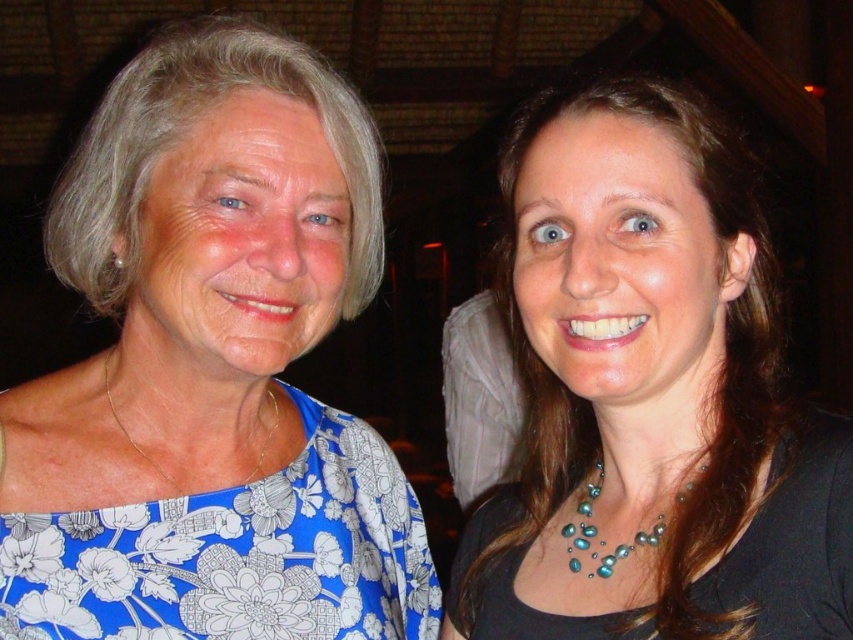
You are a photographer adjusting the lighting in this scene. You need to ensure both necklaces are equally illuminated. Which necklace should you adjust the light towards, the black matte necklace at upper center or the gold chain necklace at left?

The black matte necklace at upper center is to the right of the gold chain necklace at left. To equally illuminate both, adjust the light towards the gold chain necklace at left since it is positioned further left and may require more light to match the illumination of the right side.

You are a photographer setting up a shot for a fashion editorial. You have two focal points in the image, the blue floral fabric dress at left and the teal pearl necklace at center. Based on their positions and sizes, which object should you prioritize in your composition to ensure it doesn not get lost in the frame?

The blue floral fabric dress at left should be prioritized in the composition because it might be wider than the teal pearl necklace at center, making it more visually dominant and important to highlight.

You are a photographer adjusting the lighting in this scene. You need to ensure that the black matte necklace at upper center at point [648,397] is well lit. Which person should you focus the light on?

The black matte necklace at upper center is located at point [648,397], so you should focus the light on the person on the right since the black matte necklace at upper center is their necklace.